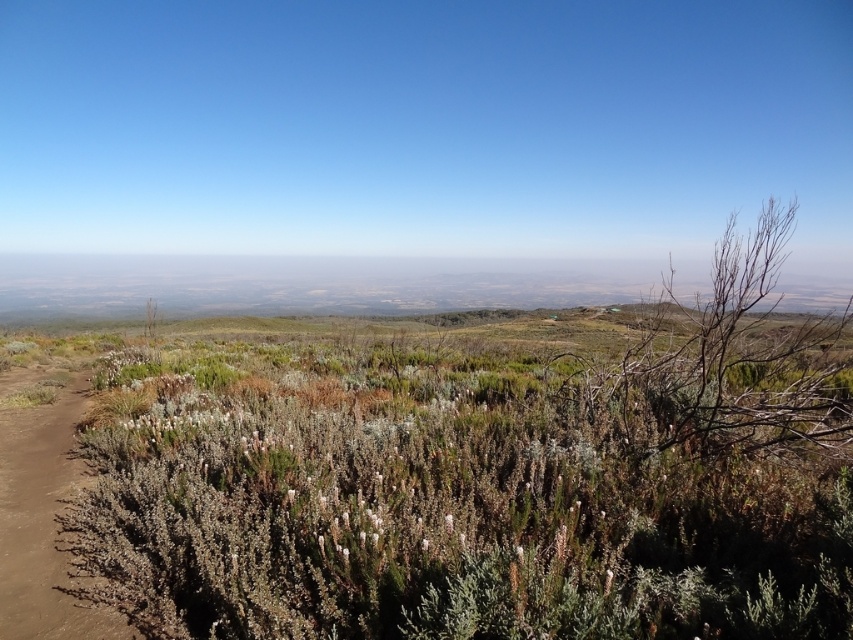
You are a hiker carrying a 2.5 meter long hiking pole. You see the green shrubbery at center in front of you. Can you pass through the gap between them without bending the pole?

The gap between the green shrubbery at center is 2.58 meters, so the 2.5 meter long hiking pole can pass through without bending.

You are a hiker with a 34 inch long hiking pole. You want to place your pole horizontally between the green shrubbery at center and the brown dirt path at lower left. Will the pole fit without bending?

The distance between the green shrubbery at center and the brown dirt path at lower left is 34.57 inches. Since the pole is 34 inches long, it will fit without bending as it is shorter than the distance.

You are a hiker standing at the brown dirt path at lower left and want to reach the green shrubbery at center. Which direction should you head to move towards it?

The green shrubbery at center is to the right of the brown dirt path at lower left, so you should head to the right to move towards it.